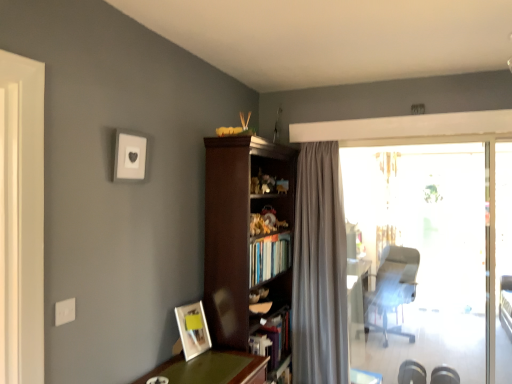
Locate an element on the screen. transparent glass door at right is located at coordinates (419, 255).

What do you see at coordinates (419, 255) in the screenshot? The image size is (512, 384). I see `transparent glass door at right` at bounding box center [419, 255].

The image size is (512, 384). What do you see at coordinates (193, 329) in the screenshot? I see `matte wooden picture frame at lower left, the 2th picture frame positioned from the top` at bounding box center [193, 329].

Consider the image. Measure the distance between matte gray frame at upper left, the second picture frame viewed from the right, and camera.

matte gray frame at upper left, the second picture frame viewed from the right, is 1.87 meters away from camera.

Describe the element at coordinates (319, 269) in the screenshot. I see `satin gray curtain at center` at that location.

Measure the distance between satin gray curtain at center and camera.

The depth of satin gray curtain at center is 3.05 meters.

What do you see at coordinates (247, 240) in the screenshot? The image size is (512, 384). I see `dark wood bookcase at center` at bounding box center [247, 240].

The width and height of the screenshot is (512, 384). What are the coordinates of `metallic silver chair at right` in the screenshot? It's located at (393, 287).

In order to click on the 2nd picture frame counting from the left of the satin gray curtain at center in this screenshot , I will do `click(130, 156)`.

Consider the image. Is satin gray curtain at center positioned beyond the bounds of matte gray frame at upper left, the second picture frame viewed from the right?

Yes, satin gray curtain at center is outside of matte gray frame at upper left, the second picture frame viewed from the right.

Does point (267, 183) appear closer or farther from the camera than point (323, 278)?

Point (267, 183) is closer to the camera than point (323, 278).

Is dark wood bookcase at center next to satin gray curtain at center?

dark wood bookcase at center and satin gray curtain at center are clearly separated.

Would you say dark wood bookcase at center is outside satin gray curtain at center?

Yes, dark wood bookcase at center is located beyond the bounds of satin gray curtain at center.

From the image's perspective, is dark wood bookcase at center located above or below transparent glass door at right?

dark wood bookcase at center is situated lower than transparent glass door at right in the image.

Does dark wood bookcase at center appear on the left side of transparent glass door at right?

Yes.

Looking at this image, considering the positions of objects dark wood bookcase at center and transparent glass door at right in the image provided, who is behind, dark wood bookcase at center or transparent glass door at right?

transparent glass door at right.

Looking at this image, does dark wood bookcase at center touch transparent glass door at right?

No, dark wood bookcase at center is not beside transparent glass door at right.

From the image's perspective, is satin gray curtain at center under hardcover books at center?

Correct, satin gray curtain at center appears lower than hardcover books at center in the image.

Identify the location of curtain behind the hardcover books at center. This screenshot has width=512, height=384. (319, 269).

Is the depth of satin gray curtain at center less than that of hardcover books at center?

No, satin gray curtain at center is behind hardcover books at center.

Is point (294, 241) closer or farther from the camera than point (269, 272)?

Point (294, 241) is positioned farther from the camera compared to point (269, 272).

Would you say hardcover books at center is inside or outside dark wood bookcase at center?

The correct answer is: inside.

Considering their positions, is hardcover books at center located in front of or behind dark wood bookcase at center?

hardcover books at center is positioned farther from the viewer than dark wood bookcase at center.

Is hardcover books at center next to dark wood bookcase at center and touching it?

No, hardcover books at center is not in contact with dark wood bookcase at center.

Considering the relative positions of hardcover books at center and dark wood bookcase at center in the image provided, is hardcover books at center to the right of dark wood bookcase at center from the viewer's perspective?

Yes.

Is metallic silver chair at right looking in the opposite direction of matte wooden picture frame at lower left, the second picture frame viewed from the front?

metallic silver chair at right is not turned away from matte wooden picture frame at lower left, the second picture frame viewed from the front.

Is matte wooden picture frame at lower left, which ranks as the 1th picture frame in right-to-left order, surrounded by metallic silver chair at right?

Definitely not — matte wooden picture frame at lower left, which ranks as the 1th picture frame in right-to-left order, is not inside metallic silver chair at right.

Between metallic silver chair at right and matte wooden picture frame at lower left, the 2th picture frame viewed from the left, which one has smaller size?

Smaller between the two is matte wooden picture frame at lower left, the 2th picture frame viewed from the left.

Which is in front, metallic silver chair at right or matte wooden picture frame at lower left, the second picture frame viewed from the front?

Positioned in front is matte wooden picture frame at lower left, the second picture frame viewed from the front.

How far apart are matte gray frame at upper left, which appears as the second picture frame when ordered from the bottom, and metallic silver chair at right?

Result: matte gray frame at upper left, which appears as the second picture frame when ordered from the bottom, and metallic silver chair at right are 4.66 meters apart.

Is matte gray frame at upper left, positioned as the 2th picture frame in back-to-front order, outside of metallic silver chair at right?

Yes.

From the image's perspective, is matte gray frame at upper left, the second picture frame viewed from the right, below metallic silver chair at right?

No.

Is matte gray frame at upper left, positioned as the 1th picture frame in front-to-back order, positioned with its back to metallic silver chair at right?

No, matte gray frame at upper left, positioned as the 1th picture frame in front-to-back order, is not facing away from metallic silver chair at right.

Find the location of a particular element. the 2nd picture frame in front of the satin gray curtain at center is located at coordinates [x=130, y=156].

The width and height of the screenshot is (512, 384). I want to click on curtain above the dark wood bookcase at center (from a real-world perspective), so click(319, 269).

Estimate the real-world distances between objects in this image. Which object is further from matte wooden picture frame at lower left, the second picture frame viewed from the front, metallic silver chair at right or transparent glass door at right?

metallic silver chair at right lies further to matte wooden picture frame at lower left, the second picture frame viewed from the front, than the other object.

Considering their positions, is metallic silver chair at right positioned closer to satin gray curtain at center than transparent glass door at right?

transparent glass door at right is closer to satin gray curtain at center.

Considering their positions, is matte gray frame at upper left, which is the 1th picture frame from top to bottom, positioned further to metallic silver chair at right than dark wood bookcase at center?

matte gray frame at upper left, which is the 1th picture frame from top to bottom, is positioned further to the anchor metallic silver chair at right.

Which object lies nearer to the anchor point hardcover books at center, dark wood bookcase at center or matte wooden picture frame at lower left, the 2th picture frame positioned from the top?

dark wood bookcase at center is closer to hardcover books at center.

From the picture: Estimate the real-world distances between objects in this image. Which object is further from hardcover books at center, matte gray frame at upper left, the second picture frame viewed from the right, or metallic silver chair at right?

The object further to hardcover books at center is metallic silver chair at right.

Estimate the real-world distances between objects in this image. Which object is further from transparent glass door at right, matte wooden picture frame at lower left, which is the 1th picture frame in back-to-front order, or hardcover books at center?

The object further to transparent glass door at right is matte wooden picture frame at lower left, which is the 1th picture frame in back-to-front order.

Which object lies further to the anchor point matte wooden picture frame at lower left, the 2th picture frame viewed from the left, transparent glass door at right or metallic silver chair at right?

Based on the image, metallic silver chair at right appears to be further to matte wooden picture frame at lower left, the 2th picture frame viewed from the left.

Estimate the real-world distances between objects in this image. Which object is closer to matte wooden picture frame at lower left, which is the 1th picture frame from bottom to top, satin gray curtain at center or matte gray frame at upper left, which is the 1th picture frame from top to bottom?

Based on the image, matte gray frame at upper left, which is the 1th picture frame from top to bottom, appears to be nearer to matte wooden picture frame at lower left, which is the 1th picture frame from bottom to top.

Locate an element on the screen. book between matte gray frame at upper left, which appears as the second picture frame when ordered from the bottom, and metallic silver chair at right in the front-back direction is located at coordinates (269, 257).

The image size is (512, 384). Identify the location of curtain between matte wooden picture frame at lower left, which is the 1th picture frame in back-to-front order, and metallic silver chair at right from front to back. (319, 269).

Where is `curtain between dark wood bookcase at center and transparent glass door at right`? The height and width of the screenshot is (384, 512). curtain between dark wood bookcase at center and transparent glass door at right is located at coordinates (319, 269).

At what (x,y) coordinates should I click in order to perform the action: click on curtain between dark wood bookcase at center and metallic silver chair at right in the front-back direction. Please return your answer as a coordinate pair (x, y). Image resolution: width=512 pixels, height=384 pixels. Looking at the image, I should click on (319, 269).